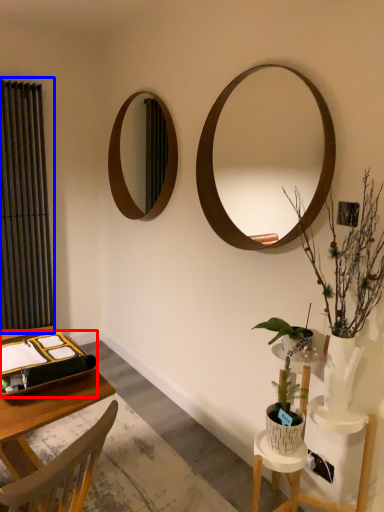
Question: Which of the following is the closest to the observer, binder (highlighted by a red box) or curtain (highlighted by a blue box)?

Choices:
 (A) binder
 (B) curtain

Answer: (A)